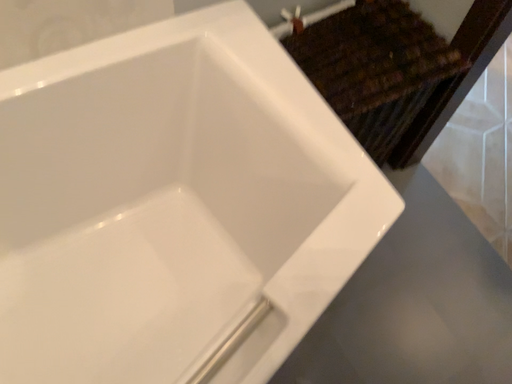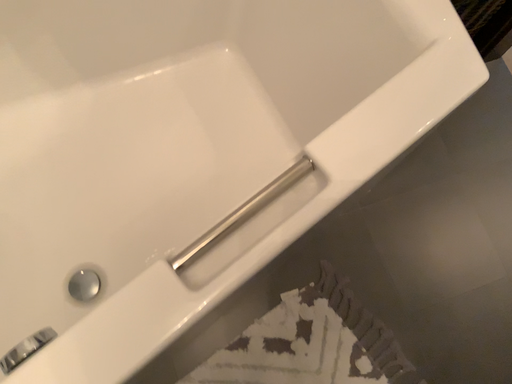
Question: Which way did the camera rotate in the video?

Choices:
 (A) rotated downward
 (B) rotated upward

Answer: (A)